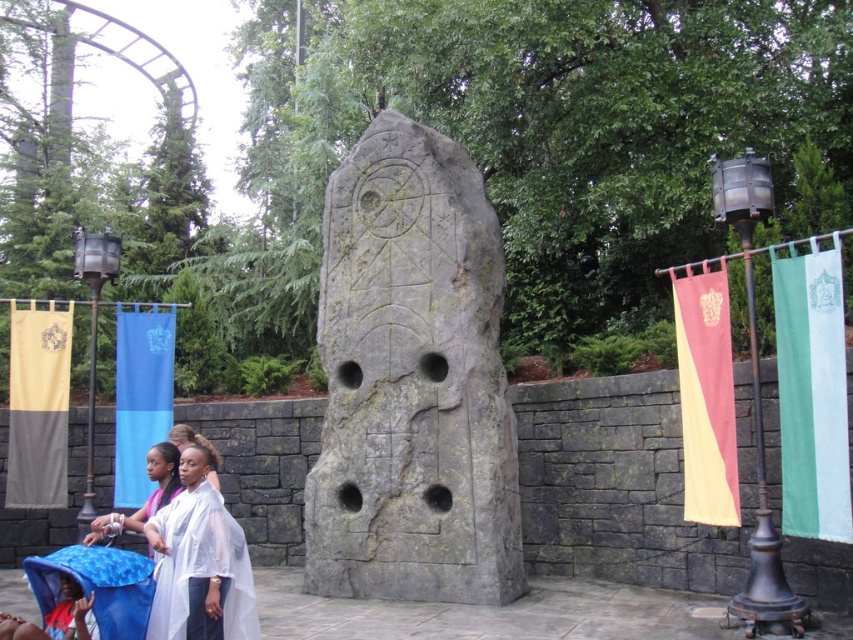
You are standing in the park and see the gray stone carving at center and the white sheer fabric at lower left. Which object is positioned higher relative to the other?

The gray stone carving at center is above the white sheer fabric at lower left, so it is positioned higher.

What are the coordinates of the gray stone carving at center?

The gray stone carving at center is located at coordinates point [412,381].